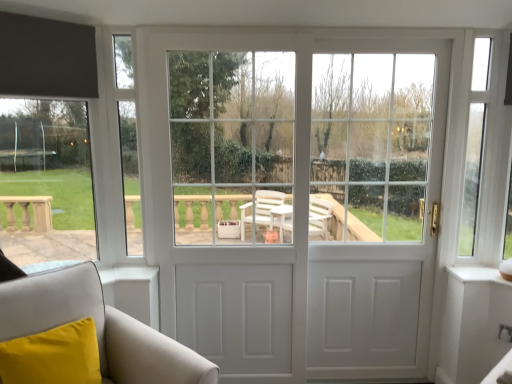
Question: Looking at their shapes, would you say white glossy door at right, which ranks as the second screen door in left-to-right order, is wider or thinner than white leather armchair at lower left?

Choices:
 (A) wide
 (B) thin

Answer: (B)

Question: In the image, is white glossy door at right, which ranks as the second screen door in left-to-right order, positioned in front of or behind white leather armchair at lower left?

Choices:
 (A) front
 (B) behind

Answer: (B)

Question: Which object is the farthest from the white matte door at center?

Choices:
 (A) white glossy door at center, which is the second screen door in right-to-left order
 (B) white glossy door at right, which is the 1th screen door from right to left
 (C) clear glass door at right
 (D) white leather armchair at lower left

Answer: (D)

Question: Which of these objects is positioned closest to the white matte door at center?

Choices:
 (A) white glossy door at right, which ranks as the second screen door in left-to-right order
 (B) white leather armchair at lower left
 (C) white glossy door at center, which is the second screen door in right-to-left order
 (D) clear glass door at right

Answer: (C)